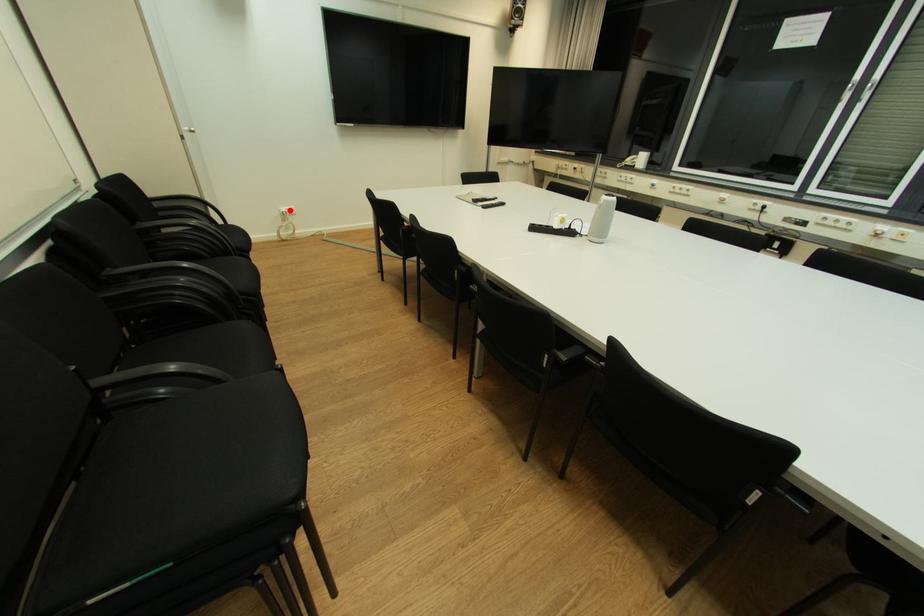
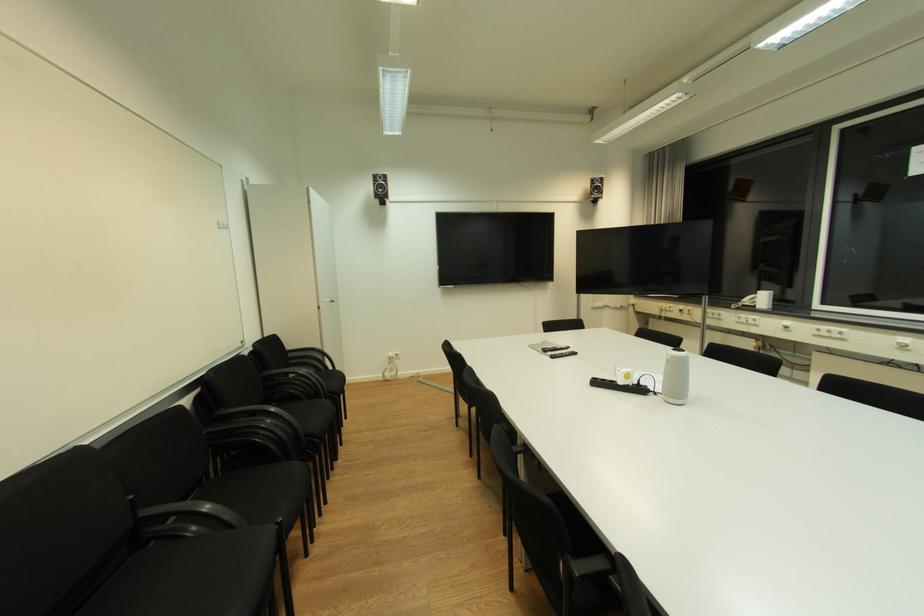
Locate, in the second image, the point that corresponds to the highlighted location in the first image.

(396, 355)